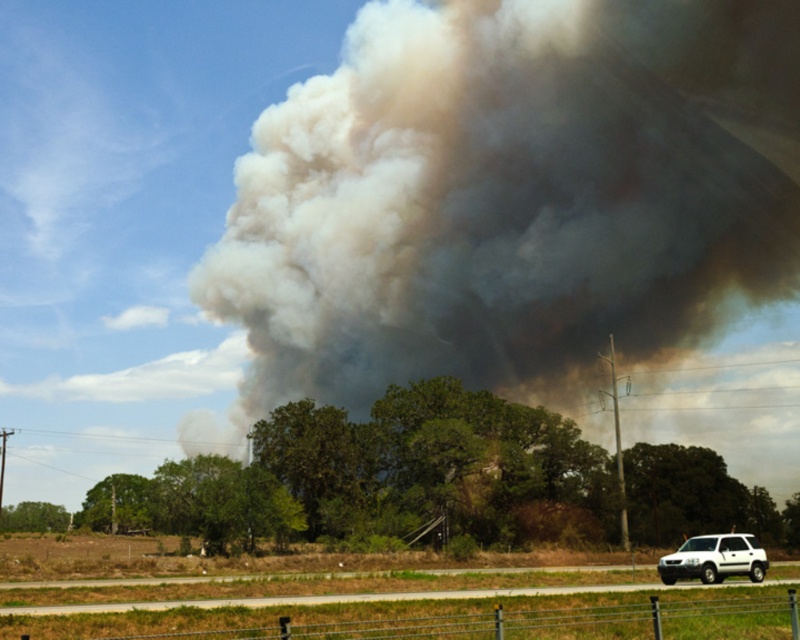
Question: Does gray/dense smoke at center appear over white matte suv at lower right?

Choices:
 (A) no
 (B) yes

Answer: (B)

Question: From the image, what is the correct spatial relationship of gray/dense smoke at center in relation to white matte suv at lower right?

Choices:
 (A) right
 (B) left

Answer: (A)

Question: Is gray/dense smoke at center positioned in front of white matte suv at lower right?

Choices:
 (A) no
 (B) yes

Answer: (A)

Question: Which object is closer to the camera taking this photo?

Choices:
 (A) white matte suv at lower right
 (B) gray/dense smoke at center

Answer: (A)

Question: Among these objects, which one is nearest to the camera?

Choices:
 (A) gray/dense smoke at center
 (B) white matte suv at lower right

Answer: (B)